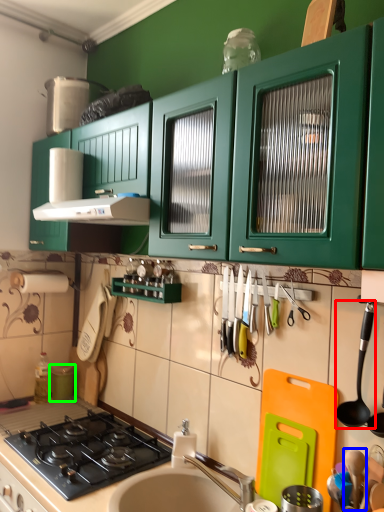
Question: Which object is positioned closest to utensil (highlighted by a red box)? Select from utensil (highlighted by a blue box) and appliance (highlighted by a green box).

Choices:
 (A) utensil
 (B) appliance

Answer: (A)